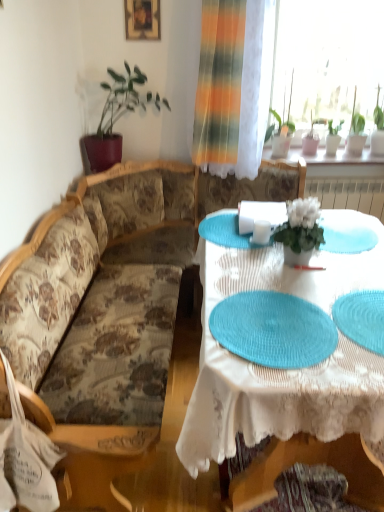
Question: From the image's perspective, does green leafy plant at upper right, which is the 5th houseplant from left to right, appear higher than white matte flower pot at center, placed as the first houseplant when sorted from front to back?

Choices:
 (A) yes
 (B) no

Answer: (A)

Question: Is green leafy plant at upper right, which ranks as the fourth houseplant in front-to-back order, at the right side of white matte flower pot at center, placed as the 2th houseplant when sorted from left to right?

Choices:
 (A) no
 (B) yes

Answer: (B)

Question: Considering the relative sizes of green leafy plant at upper right, the second houseplant when ordered from back to front, and white matte flower pot at center, placed as the first houseplant when sorted from front to back, in the image provided, is green leafy plant at upper right, the second houseplant when ordered from back to front, thinner than white matte flower pot at center, placed as the first houseplant when sorted from front to back,?

Choices:
 (A) yes
 (B) no

Answer: (A)

Question: Can you confirm if green leafy plant at upper right, which ranks as the fourth houseplant in front-to-back order, is bigger than white matte flower pot at center, placed as the 2th houseplant when sorted from left to right?

Choices:
 (A) yes
 (B) no

Answer: (A)

Question: Is green leafy plant at upper right, the second houseplant when ordered from back to front, not inside white matte flower pot at center, placed as the 2th houseplant when sorted from left to right?

Choices:
 (A) no
 (B) yes

Answer: (B)

Question: Is there a large distance between green leafy plant at upper right, the second houseplant when ordered from back to front, and white matte flower pot at center, positioned as the 5th houseplant in back-to-front order?

Choices:
 (A) yes
 (B) no

Answer: (A)

Question: Is green leafy plant at upper right, which ranks as the 3th houseplant in front-to-back order, placed right next to wooden picture frame at upper center?

Choices:
 (A) no
 (B) yes

Answer: (A)

Question: Is wooden picture frame at upper center inside green leafy plant at upper right, the third houseplant positioned from the left?

Choices:
 (A) yes
 (B) no

Answer: (B)

Question: Does green leafy plant at upper right, the 3th houseplant viewed from the right, have a smaller size compared to wooden picture frame at upper center?

Choices:
 (A) yes
 (B) no

Answer: (B)

Question: Can you confirm if green leafy plant at upper right, the third houseplant viewed from the back, is positioned to the right of wooden picture frame at upper center?

Choices:
 (A) yes
 (B) no

Answer: (A)

Question: Is green leafy plant at upper right, the 3th houseplant viewed from the right, further to the viewer compared to wooden picture frame at upper center?

Choices:
 (A) no
 (B) yes

Answer: (B)

Question: Is green leafy plant at upper right, the third houseplant positioned from the left, outside of wooden picture frame at upper center?

Choices:
 (A) no
 (B) yes

Answer: (B)

Question: Does blue woven placemat at lower right have a larger size compared to green matte plant at upper right, which appears as the fifth houseplant when viewed from the front?

Choices:
 (A) no
 (B) yes

Answer: (A)